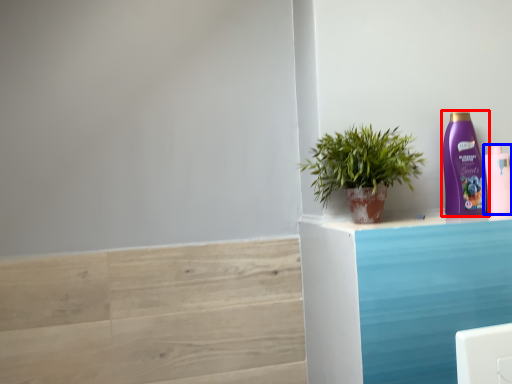
Question: Which of the following is the farthest to the observer, bottle (highlighted by a red box) or bottle (highlighted by a blue box)?

Choices:
 (A) bottle
 (B) bottle

Answer: (B)